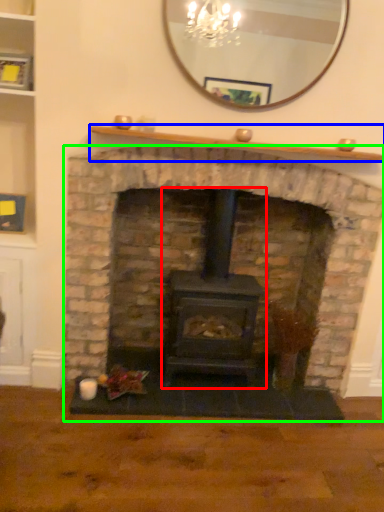
Question: Considering the real-world distances, which object is farthest from wood burning stove (highlighted by a red box)? mantle (highlighted by a blue box) or fireplace (highlighted by a green box)?

Choices:
 (A) mantle
 (B) fireplace

Answer: (A)